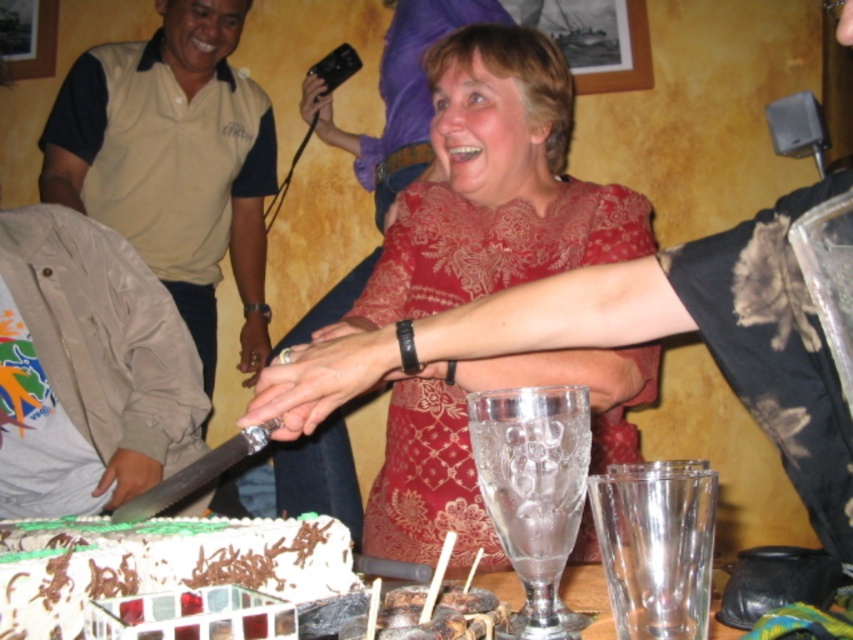
Does beige cotton shirt at left appear on the right side of translucent glass cups at lower center?

Incorrect, beige cotton shirt at left is not on the right side of translucent glass cups at lower center.

Between point (167, 42) and point (579, 579), which one is positioned behind?

The point (167, 42) is more distant.

Identify the location of beige cotton shirt at left. This screenshot has height=640, width=853. coord(173,161).

Is the position of matte red dress at center less distant than that of white chocolate cake at lower left?

No.

Between point (505, 371) and point (332, 552), which one is positioned behind?

Point (505, 371)

Locate an element on the screen. matte red dress at center is located at coordinates (494, 188).

Who is more distant from viewer, (x=242, y=120) or (x=39, y=529)?

Positioned behind is point (x=242, y=120).

Can you confirm if beige cotton shirt at left is thinner than white chocolate cake at lower left?

Incorrect, beige cotton shirt at left's width is not less than white chocolate cake at lower left's.

Which is behind, point (123, 42) or point (256, 536)?

The point (123, 42) is more distant.

This screenshot has width=853, height=640. I want to click on beige cotton shirt at left, so click(x=173, y=161).